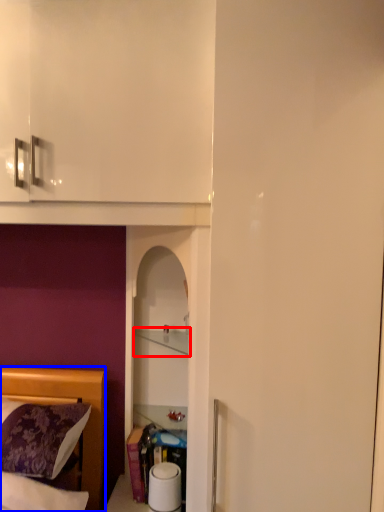
Question: Among these objects, which one is farthest to the camera, cabinet (highlighted by a red box) or bed (highlighted by a blue box)?

Choices:
 (A) cabinet
 (B) bed

Answer: (A)